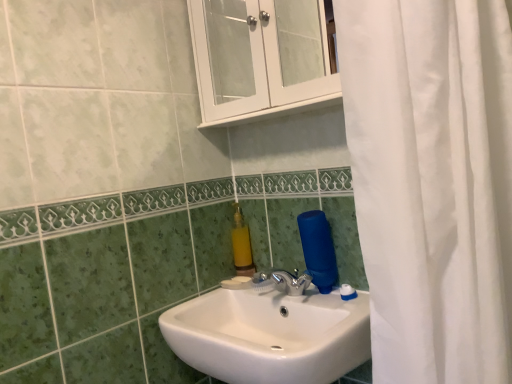
Measure the distance between point (245, 250) and camera.

4.40 feet.

What is the approximate width of yellow matte soap dispenser at upper center?

It is 5.71 centimeters.

The width and height of the screenshot is (512, 384). What do you see at coordinates (258, 68) in the screenshot?
I see `white glossy cabinet at upper center` at bounding box center [258, 68].

Find the location of a particular element. This screenshot has width=512, height=384. white glossy cabinet at upper center is located at coordinates (258, 68).

Locate an element on the screen. This screenshot has width=512, height=384. yellow matte soap dispenser at upper center is located at coordinates (241, 245).

Is point (187, 362) positioned after point (238, 261)?

No, (187, 362) is in front of (238, 261).

Looking at this image, does white glossy sink at center appear on the right side of yellow matte soap dispenser at upper center?

Correct, you'll find white glossy sink at center to the right of yellow matte soap dispenser at upper center.

What are the coordinates of `soap dispenser to the left of white glossy sink at center` in the screenshot? It's located at (241, 245).

From the image's perspective, is white glossy sink at center above or below yellow matte soap dispenser at upper center?

Clearly, from the image's perspective, white glossy sink at center is below yellow matte soap dispenser at upper center.

Does yellow matte soap dispenser at upper center appear on the left side of white glossy sink at center?

Yes, yellow matte soap dispenser at upper center is to the left of white glossy sink at center.

Looking at this image, is yellow matte soap dispenser at upper center bigger than white glossy sink at center?

Incorrect, yellow matte soap dispenser at upper center is not larger than white glossy sink at center.

Is yellow matte soap dispenser at upper center surrounding white glossy sink at center?

That's incorrect, white glossy sink at center is not inside yellow matte soap dispenser at upper center.

From a real-world perspective, which is physically below, yellow matte soap dispenser at upper center or white glossy sink at center?

white glossy sink at center, from a real-world perspective.

Consider the image. Is white glossy cabinet at upper center positioned with its back to white glossy sink at center?

No, white glossy cabinet at upper center is not facing away from white glossy sink at center.

Relative to white glossy sink at center, is white glossy cabinet at upper center in front or behind?

In the image, white glossy cabinet at upper center appears behind white glossy sink at center.

Does white glossy cabinet at upper center have a greater height compared to white glossy sink at center?

Indeed, white glossy cabinet at upper center has a greater height compared to white glossy sink at center.

Is point (312, 345) closer to viewer compared to point (202, 22)?

That is True.

Does white glossy sink at center lie in front of white glossy cabinet at upper center?

Yes, it is in front of white glossy cabinet at upper center.

From a real-world perspective, is white glossy sink at center positioned above or below white glossy cabinet at upper center?

white glossy sink at center is situated lower than white glossy cabinet at upper center in the real world.

From the image's perspective, who appears lower, white glossy cabinet at upper center or yellow matte soap dispenser at upper center?

yellow matte soap dispenser at upper center, from the image's perspective.

Consider the image. Is white glossy cabinet at upper center smaller than yellow matte soap dispenser at upper center?

Actually, white glossy cabinet at upper center might be larger than yellow matte soap dispenser at upper center.

Choose the correct answer: Is white glossy cabinet at upper center inside yellow matte soap dispenser at upper center or outside it?

white glossy cabinet at upper center lies outside yellow matte soap dispenser at upper center.

Could you measure the distance between white glossy cabinet at upper center and yellow matte soap dispenser at upper center?

They are 17.11 inches apart.

Is white glossy cabinet at upper center located within yellow matte soap dispenser at upper center?

Definitely not — white glossy cabinet at upper center is not inside yellow matte soap dispenser at upper center.

From a real-world perspective, between yellow matte soap dispenser at upper center and white glossy cabinet at upper center, who is vertically lower?

yellow matte soap dispenser at upper center.

Does point (238, 226) appear closer or farther from the camera than point (190, 24)?

Point (238, 226) appears to be farther away from the viewer than point (190, 24).

The width and height of the screenshot is (512, 384). What are the coordinates of `soap dispenser on the left of white glossy sink at center` in the screenshot? It's located at (241, 245).

You are a GUI agent. You are given a task and a screenshot of the screen. Output one action in this format:
    pyautogui.click(x=<x>, y=<y>)
    Task: Click on the sink on the right of yellow matte soap dispenser at upper center
    This screenshot has height=384, width=512.
    Given the screenshot: What is the action you would take?
    pyautogui.click(x=270, y=331)

Based on their spatial positions, is yellow matte soap dispenser at upper center or white glossy sink at center further from white glossy cabinet at upper center?

Based on the image, white glossy sink at center appears to be further to white glossy cabinet at upper center.

Based on their spatial positions, is yellow matte soap dispenser at upper center or white glossy cabinet at upper center further from white glossy sink at center?

white glossy cabinet at upper center lies further to white glossy sink at center than the other object.

Looking at this image, estimate the real-world distances between objects in this image. Which object is closer to yellow matte soap dispenser at upper center, white glossy sink at center or white glossy cabinet at upper center?

white glossy sink at center lies closer to yellow matte soap dispenser at upper center than the other object.

Based on their spatial positions, is white glossy cabinet at upper center or yellow matte soap dispenser at upper center closer to white glossy sink at center?

Among the two, yellow matte soap dispenser at upper center is located nearer to white glossy sink at center.

Looking at the image, which one is located closer to white glossy cabinet at upper center, white glossy sink at center or yellow matte soap dispenser at upper center?

yellow matte soap dispenser at upper center.

Considering their positions, is white glossy cabinet at upper center positioned closer to yellow matte soap dispenser at upper center than white glossy sink at center?

The object closer to yellow matte soap dispenser at upper center is white glossy sink at center.

Identify the location of soap dispenser between white glossy cabinet at upper center and white glossy sink at center in the vertical direction. (241, 245).